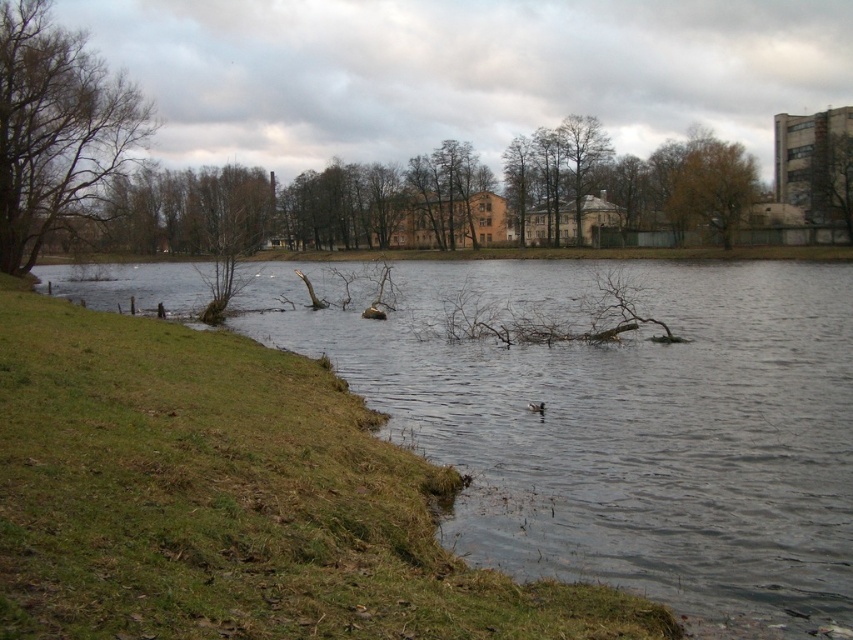
Is green grass at lower left to the left of brown textured tree at upper right from the viewer's perspective?

Indeed, green grass at lower left is positioned on the left side of brown textured tree at upper right.

Image resolution: width=853 pixels, height=640 pixels. Describe the element at coordinates (624, 426) in the screenshot. I see `green grass at lower left` at that location.

Between point (465, 266) and point (735, 157), which one is positioned in front?

Positioned in front is point (735, 157).

Identify the location of green grass at lower left. This screenshot has width=853, height=640. (624, 426).

Is green grass at lower left above brown leafless tree at left?

No.

Which of these two, green grass at lower left or brown leafless tree at left, stands shorter?

With less height is green grass at lower left.

Who is more forward, (505, 392) or (41, 232)?

Point (505, 392)

The image size is (853, 640). What are the coordinates of `green grass at lower left` in the screenshot? It's located at (624, 426).

Can you confirm if brown leafless tree at left is positioned below brown matte duck at center?

No.

You are a GUI agent. You are given a task and a screenshot of the screen. Output one action in this format:
    pyautogui.click(x=<x>, y=<y>)
    Task: Click on the brown leafless tree at left
    The height and width of the screenshot is (640, 853).
    Given the screenshot: What is the action you would take?
    pyautogui.click(x=56, y=129)

At what (x,y) coordinates should I click in order to perform the action: click on brown leafless tree at left. Please return your answer as a coordinate pair (x, y). This screenshot has width=853, height=640. Looking at the image, I should click on (56, 129).